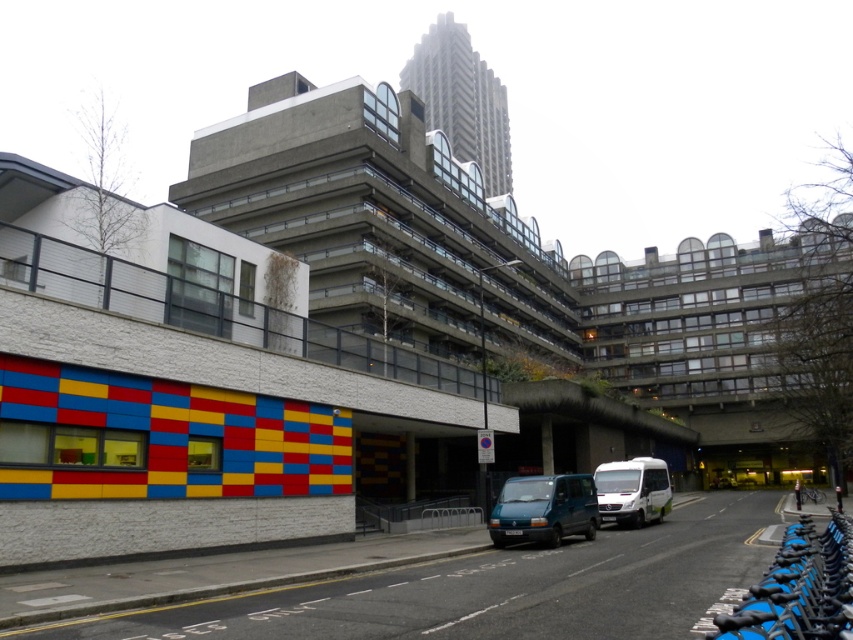
Question: Does teal matte van at center have a lesser width compared to white matte van at center-right?

Choices:
 (A) no
 (B) yes

Answer: (B)

Question: Which point is closer to the camera?

Choices:
 (A) (537, 536)
 (B) (637, 513)

Answer: (A)

Question: Which point is farther to the camera?

Choices:
 (A) white matte van at center-right
 (B) teal matte van at center

Answer: (A)

Question: Can you confirm if teal matte van at center is positioned below white matte van at center-right?

Choices:
 (A) no
 (B) yes

Answer: (A)

Question: From the image, what is the correct spatial relationship of teal matte van at center in relation to white matte van at center-right?

Choices:
 (A) right
 (B) left

Answer: (B)

Question: Which point is closer to the camera taking this photo?

Choices:
 (A) (538, 477)
 (B) (653, 497)

Answer: (A)